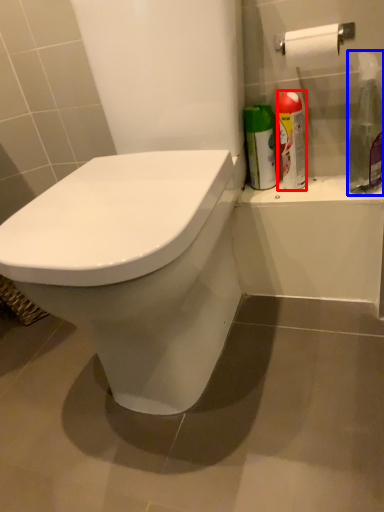
Question: Which of the following is the closest to the observer, cleaning product (highlighted by a red box) or cleaning product (highlighted by a blue box)?

Choices:
 (A) cleaning product
 (B) cleaning product

Answer: (B)